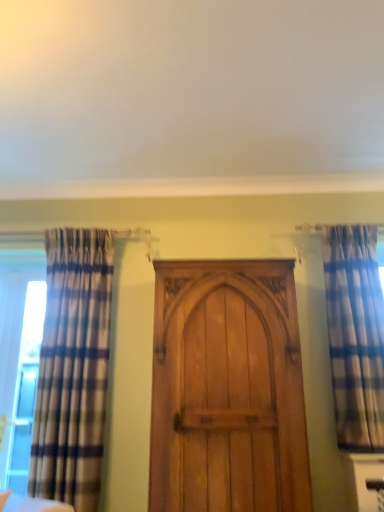
Question: Considering the relative sizes of wooden door at center and plaid fabric curtain at left, which appears as the first curtain when viewed from the left, in the image provided, is wooden door at center thinner than plaid fabric curtain at left, which appears as the first curtain when viewed from the left,?

Choices:
 (A) no
 (B) yes

Answer: (A)

Question: Can you confirm if wooden door at center is smaller than plaid fabric curtain at left, which appears as the first curtain when viewed from the left?

Choices:
 (A) no
 (B) yes

Answer: (B)

Question: From a real-world perspective, is wooden door at center positioned under plaid fabric curtain at left, which appears as the first curtain when viewed from the left, based on gravity?

Choices:
 (A) no
 (B) yes

Answer: (B)

Question: Does wooden door at center have a greater height compared to plaid fabric curtain at left, which appears as the first curtain when viewed from the left?

Choices:
 (A) yes
 (B) no

Answer: (B)

Question: Is wooden door at center directly adjacent to plaid fabric curtain at left, the second curtain in the right-to-left sequence?

Choices:
 (A) no
 (B) yes

Answer: (A)

Question: From a real-world perspective, is plaid fabric curtain at right, positioned as the first curtain in right-to-left order, physically located above or below plaid fabric curtain at left, which appears as the first curtain when viewed from the left?

Choices:
 (A) below
 (B) above

Answer: (B)

Question: Is plaid fabric curtain at right, positioned as the first curtain in right-to-left order, situated inside plaid fabric curtain at left, the second curtain in the right-to-left sequence, or outside?

Choices:
 (A) outside
 (B) inside

Answer: (A)

Question: In terms of size, does plaid fabric curtain at right, positioned as the first curtain in right-to-left order, appear bigger or smaller than plaid fabric curtain at left, the second curtain in the right-to-left sequence?

Choices:
 (A) small
 (B) big

Answer: (A)

Question: From their relative heights in the image, would you say plaid fabric curtain at right, positioned as the first curtain in right-to-left order, is taller or shorter than plaid fabric curtain at left, the second curtain in the right-to-left sequence?

Choices:
 (A) tall
 (B) short

Answer: (B)

Question: Looking at their shapes, would you say wooden door at center is wider or thinner than plaid fabric curtain at left, which appears as the first curtain when viewed from the left?

Choices:
 (A) wide
 (B) thin

Answer: (A)

Question: From the image's perspective, relative to plaid fabric curtain at left, which appears as the first curtain when viewed from the left, is wooden door at center above or below?

Choices:
 (A) below
 (B) above

Answer: (A)

Question: Visually, is wooden door at center positioned to the left or to the right of plaid fabric curtain at left, which appears as the first curtain when viewed from the left?

Choices:
 (A) left
 (B) right

Answer: (A)

Question: Based on their sizes in the image, would you say wooden door at center is bigger or smaller than plaid fabric curtain at left, which appears as the first curtain when viewed from the left?

Choices:
 (A) small
 (B) big

Answer: (A)

Question: Choose the correct answer: Is clear glass window at left inside plaid fabric curtain at left, the second curtain in the right-to-left sequence, or outside it?

Choices:
 (A) outside
 (B) inside

Answer: (A)

Question: Is point (33, 401) positioned closer to the camera than point (56, 282)?

Choices:
 (A) farther
 (B) closer

Answer: (A)